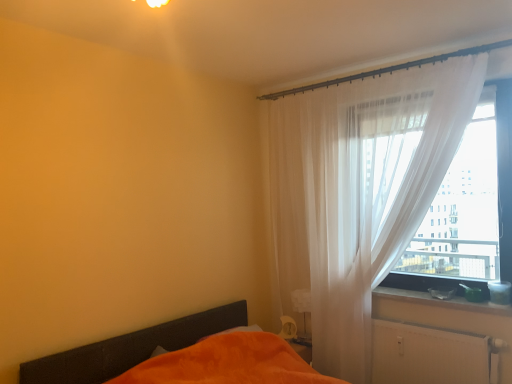
Find the location of a particular element. This screenshot has height=384, width=512. empty space that is ontop of white matte radiator at lower right (from a real-world perspective) is located at coordinates (429, 323).